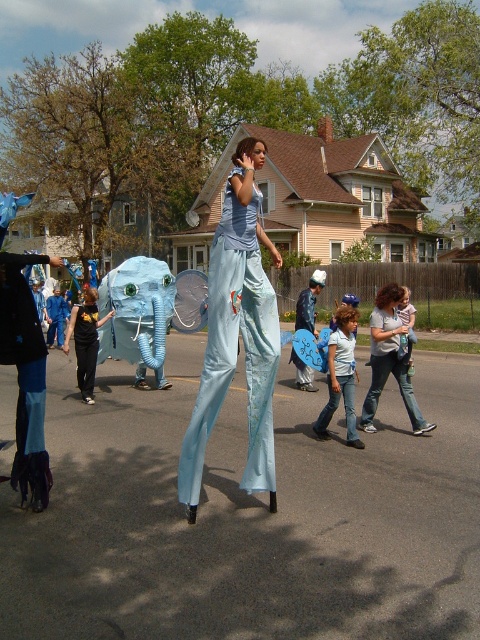
Is light blue fabric elephant at center positioned before curly hair woman at center?

Yes, light blue fabric elephant at center is closer to the viewer.

Between light blue fabric elephant at center and curly hair woman at center, which one is positioned lower?

Positioned lower is curly hair woman at center.

Where is `light blue fabric elephant at center`? light blue fabric elephant at center is located at coordinates (266, 244).

Does light blue fabric pants at center have a greater height compared to black cotton t-shirt at left?

Indeed, light blue fabric pants at center has a greater height compared to black cotton t-shirt at left.

Where is `light blue fabric pants at center`? The width and height of the screenshot is (480, 640). light blue fabric pants at center is located at coordinates (235, 369).

Is point (84, 333) farther from camera compared to point (80, 372)?

No.

Which is below, black matte shirt at center or black cotton t-shirt at left?

Positioned lower is black cotton t-shirt at left.

Is point (87, 307) positioned before point (90, 353)?

That is True.

Locate an element on the screen. This screenshot has height=640, width=480. black matte shirt at center is located at coordinates (85, 340).